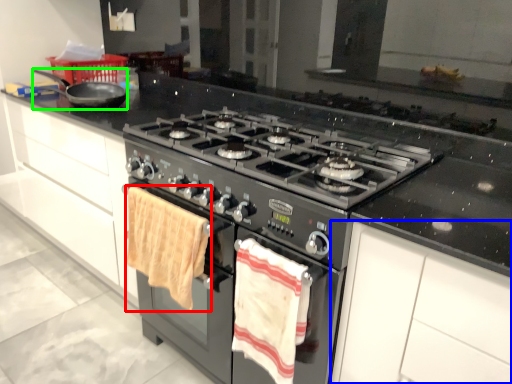
Question: Which is farther away from beach towel (highlighted by a red box)? cabinetry (highlighted by a blue box) or frying pan (highlighted by a green box)?

Choices:
 (A) cabinetry
 (B) frying pan

Answer: (B)